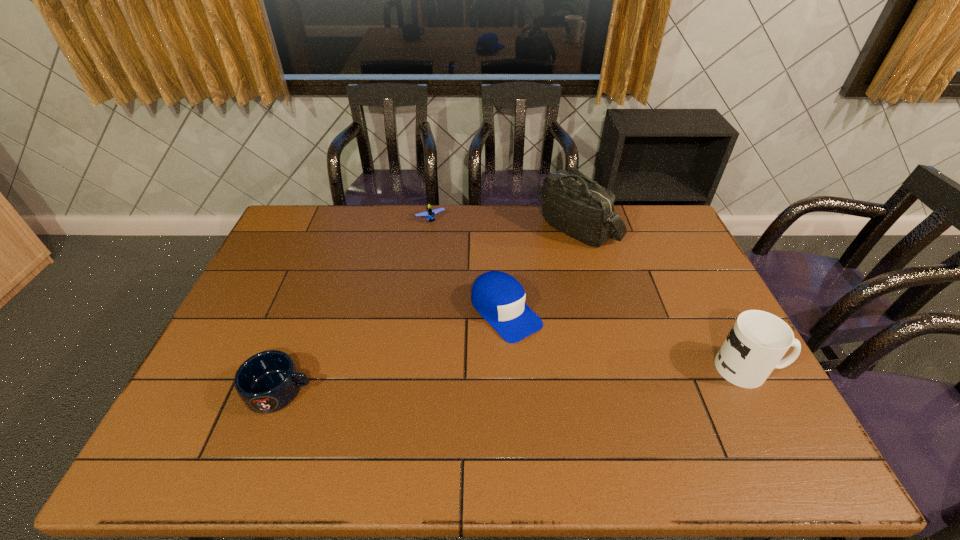
Where is `vacant space located with the handle on the side of the shorter mug`? The image size is (960, 540). vacant space located with the handle on the side of the shorter mug is located at coordinates (403, 391).

Locate an element on the screen. The width and height of the screenshot is (960, 540). vacant space positioned on the front-facing side of the third object from right to left is located at coordinates (588, 400).

This screenshot has height=540, width=960. Identify the location of vacant region located on the front-facing side of the third object from right to left. (549, 360).

Image resolution: width=960 pixels, height=540 pixels. I want to click on free space located on the front-facing side of the third object from right to left, so click(564, 375).

Find the location of a particular element. free point located at the front padded panel of the second object from right to left is located at coordinates (528, 296).

I want to click on vacant area situated at the front padded panel of the second object from right to left, so click(509, 321).

You are a GUI agent. You are given a task and a screenshot of the screen. Output one action in this format:
    pyautogui.click(x=<x>, y=<y>)
    Task: Click on the blank area located 0.170m at the front padded panel of the second object from right to left
    This screenshot has height=540, width=960.
    Given the screenshot: What is the action you would take?
    pyautogui.click(x=541, y=278)

Image resolution: width=960 pixels, height=540 pixels. What are the coordinates of `vacant space situated 0.200m on the front-facing side of the shortest object` in the screenshot? It's located at (454, 258).

You are a GUI agent. You are given a task and a screenshot of the screen. Output one action in this format:
    pyautogui.click(x=<x>, y=<y>)
    Task: Click on the vacant area located on the front-facing side of the shortest object
    Image resolution: width=960 pixels, height=540 pixels.
    Given the screenshot: What is the action you would take?
    pyautogui.click(x=446, y=245)

At what (x,y) coordinates should I click in order to perform the action: click on blank space located on the front-facing side of the shortest object. Please return your answer as a coordinate pair (x, y). Image resolution: width=960 pixels, height=540 pixels. Looking at the image, I should click on (464, 275).